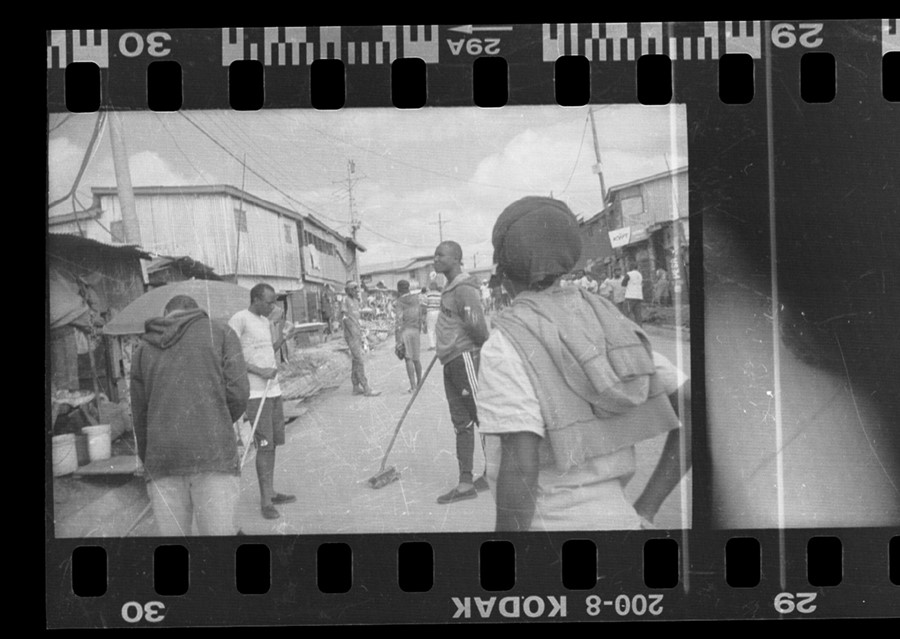
The image size is (900, 639). Find the location of `broom`. broom is located at coordinates coord(385,473).